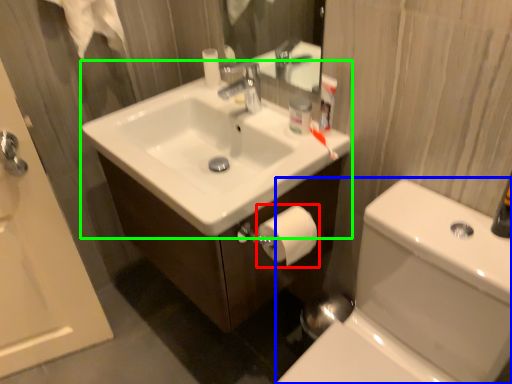
Question: Which object is the farthest from toilet paper (highlighted by a red box)? Choose among these: toilet bowl (highlighted by a blue box) or sink (highlighted by a green box).

Choices:
 (A) toilet bowl
 (B) sink

Answer: (A)